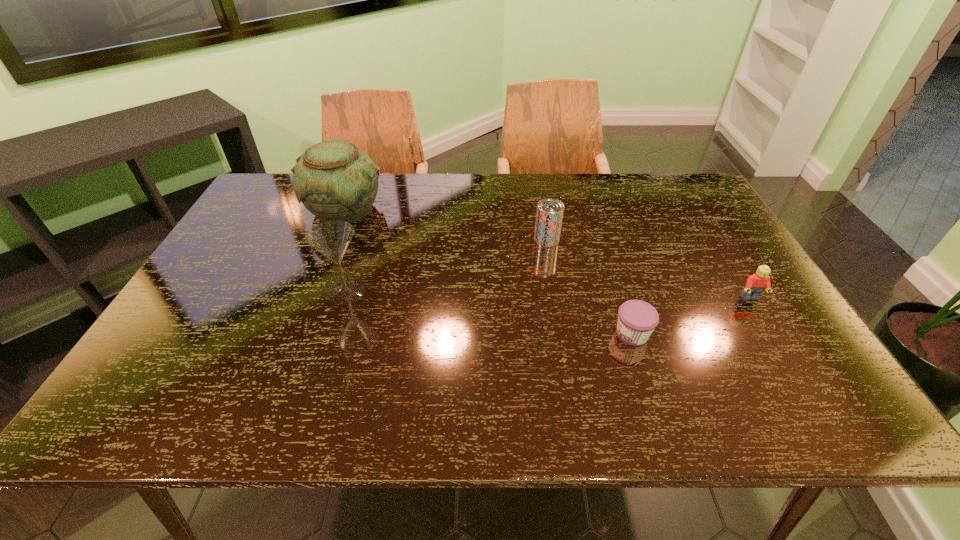
The height and width of the screenshot is (540, 960). I want to click on vacant position located on the front label of the jam, so click(x=527, y=334).

You are a GUI agent. You are given a task and a screenshot of the screen. Output one action in this format:
    pyautogui.click(x=<x>, y=<y>)
    Task: Click on the vacant region located on the front label of the jam
    
    Given the screenshot: What is the action you would take?
    pyautogui.click(x=479, y=334)

This screenshot has height=540, width=960. Identify the location of vacant area situated 0.250m on the front label of the jam. (505, 334).

Where is `object positioned at the far edge`? This screenshot has height=540, width=960. object positioned at the far edge is located at coordinates (335, 180).

Identify the location of object positioned at the right edge. (755, 284).

Image resolution: width=960 pixels, height=540 pixels. I want to click on vacant space at the far edge, so click(x=489, y=209).

This screenshot has height=540, width=960. In the image, there is a desktop. Identify the location of blank space at the near edge. (756, 417).

Image resolution: width=960 pixels, height=540 pixels. Find the location of `vacant space at the right edge of the desktop`. vacant space at the right edge of the desktop is located at coordinates pyautogui.click(x=749, y=372).

The height and width of the screenshot is (540, 960). In order to click on vacant region at the far left corner in this screenshot , I will do `click(285, 186)`.

At what (x,y) coordinates should I click in order to perform the action: click on free space between the rightmost object and the shortest object. Please return your answer as a coordinate pair (x, y). Image resolution: width=960 pixels, height=540 pixels. Looking at the image, I should click on (691, 316).